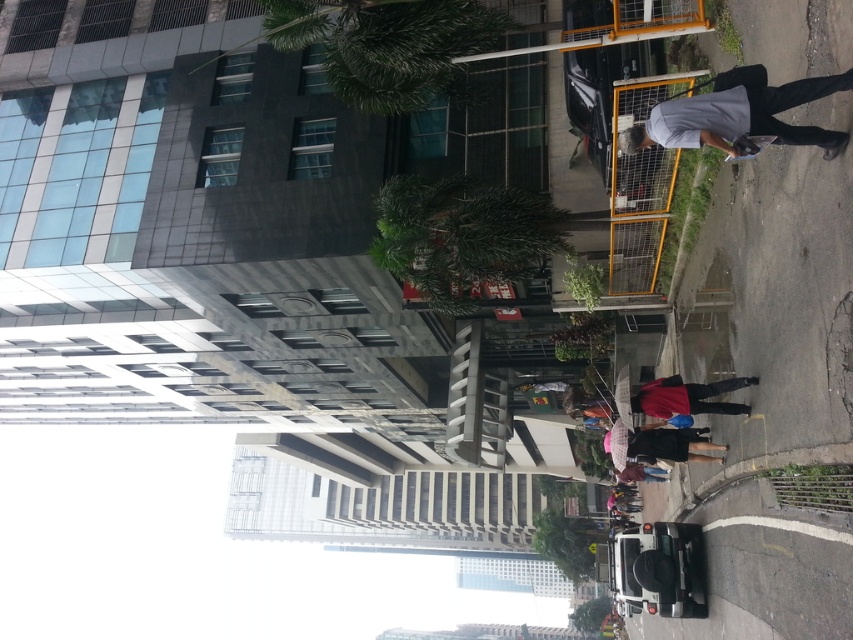
You are a delivery person carrying a large package that requires placing it on either the gray matte skateboard at right or the pink fabric umbrella at center. Which object can better support the package based on their sizes?

The gray matte skateboard at right is bigger than the pink fabric umbrella at center, so it can better support the package.

You are a delivery person who needs to pick up a pink fabric umbrella at center from the ground. However, there is a gray matte skateboard at right blocking your path. Can you reach the umbrella without moving the skateboard?

The gray matte skateboard at right is located above the pink fabric umbrella at center, so the skateboard is not blocking the path to the umbrella. You can reach the umbrella without moving the skateboard.

You are a photographer standing at the center of the urban street scene. You want to take a photo that includes both the point at coordinates point (741, 68) and point (664, 436). Which point will appear larger in your photo?

Point (741, 68) is closer to the camera than point (664, 436), so it will appear larger in the photo.